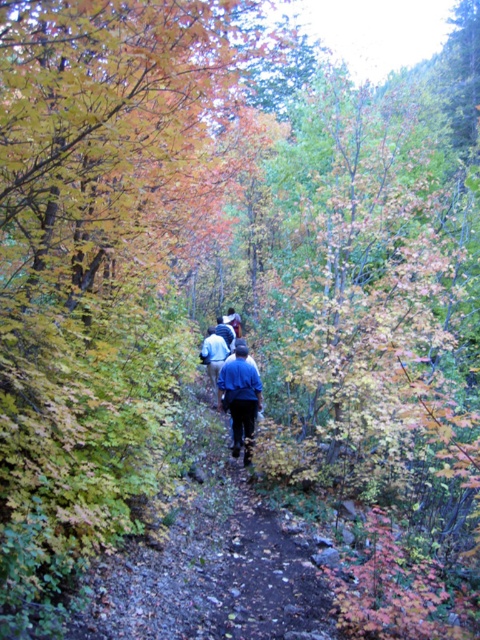
You are hiking along the dirt path and notice a blue denim jacket at center. If you want to pick it up, which direction should you move relative to your current position on the path?

The blue denim jacket at center is located at point 0.620 along the path, so you should move forward along the path towards the jacket to pick it up.

You are a hiker preparing to walk along the narrow dirt path in the autumn forest. You have two jackets, the blue denim jacket at center and the blue fabric jacket at center. Which jacket should you choose to wear if you want to keep your head warmer?

The blue denim jacket at center has a greater height compared to the blue fabric jacket at center, so it might provide better coverage and warmth for your head.